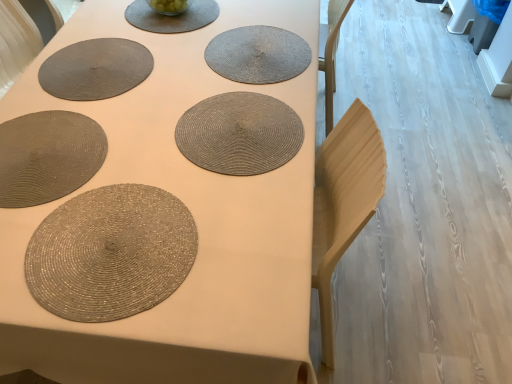
Locate an element on the screen. free space above matte gray placemat at upper left, arranged as the 3th paper plate when ordered from the bottom (from a real-world perspective) is located at coordinates click(93, 65).